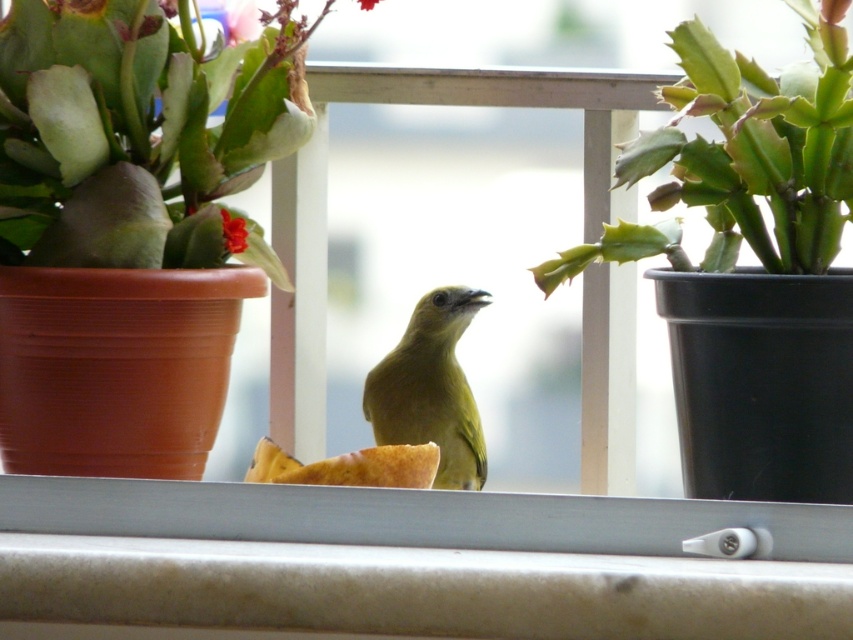
Question: Which object is farther from the camera taking this photo?

Choices:
 (A) metallic silver frame at center
 (B) smooth red flower at center

Answer: (B)

Question: Which of these objects is positioned farthest from the green succulent at right?

Choices:
 (A) green matte succulent at left
 (B) green matte flower at center
 (C) metallic silver frame at center

Answer: (A)

Question: Can you confirm if pink matte flower at upper left is positioned to the left of smooth red flower at center?

Choices:
 (A) yes
 (B) no

Answer: (A)

Question: Which of the following is the closest to the observer?

Choices:
 (A) metallic silver frame at center
 (B) green succulent at right
 (C) smooth red flower at center
 (D) pink matte flower at upper left

Answer: (A)

Question: Is green matte succulent at left above green matte flower at center?

Choices:
 (A) yes
 (B) no

Answer: (B)

Question: From the image, what is the correct spatial relationship of green matte succulent at left in relation to smooth red flower at center?

Choices:
 (A) left
 (B) right

Answer: (A)